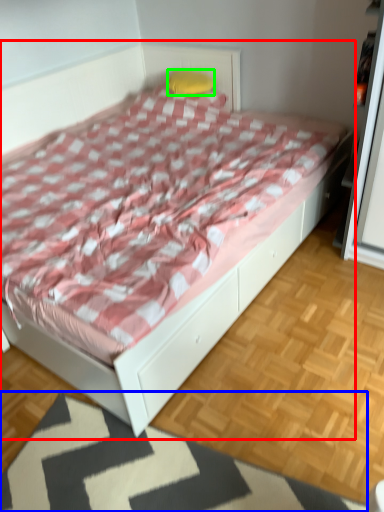
Question: Which object is positioned farthest from bed (highlighted by a red box)? Select from mat (highlighted by a blue box) and pillow (highlighted by a green box).

Choices:
 (A) mat
 (B) pillow

Answer: (B)